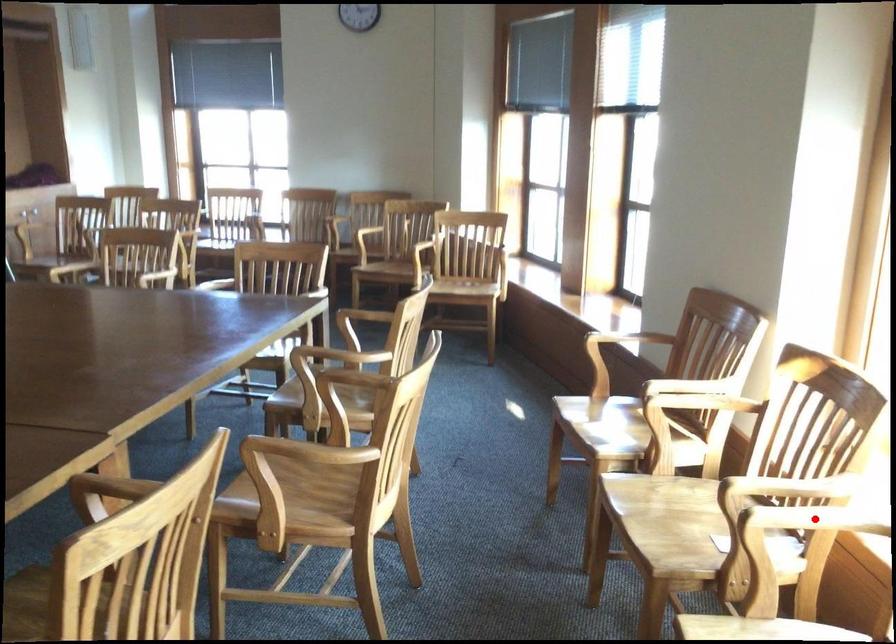
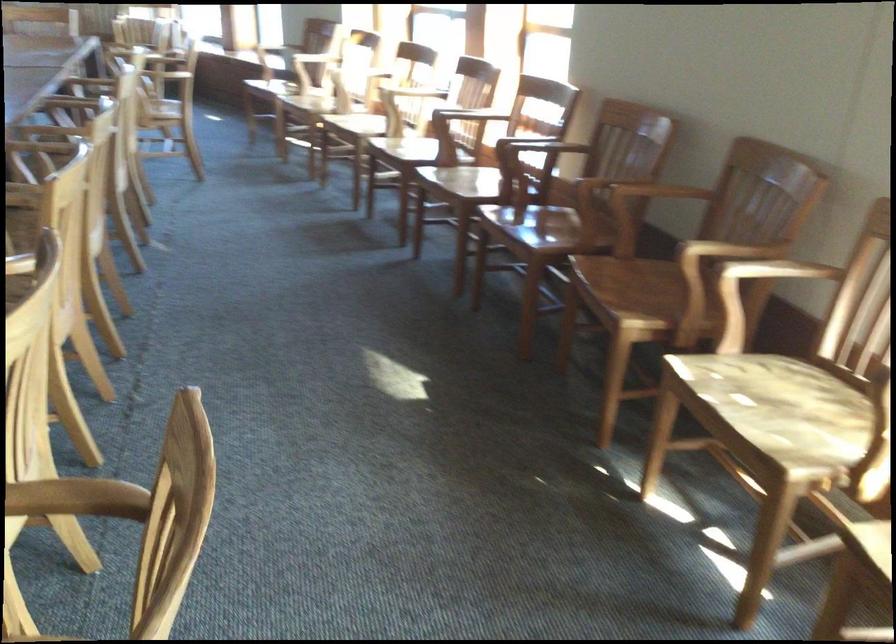
Question: I am providing you with two images of the same scene from different viewpoints. A red point is marked on the first image. At the location where the point appears in image 1, is it still visible in image 2?

Choices:
 (A) Yes
 (B) No

Answer: (B)